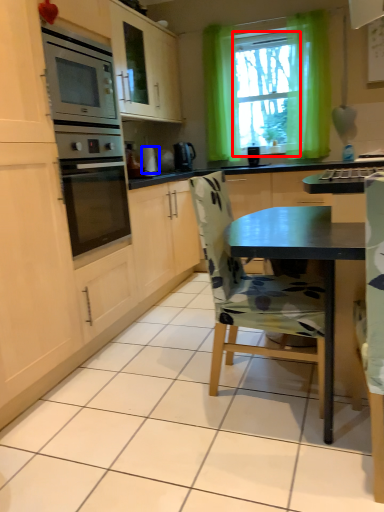
Question: Which object appears closest to the camera in this image, window screen (highlighted by a red box) or appliance (highlighted by a blue box)?

Choices:
 (A) window screen
 (B) appliance

Answer: (A)